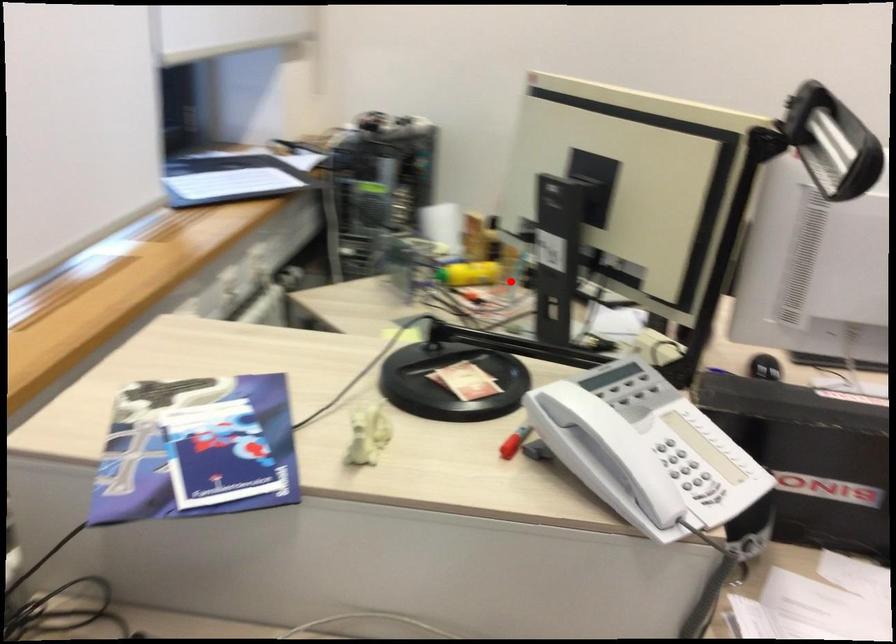
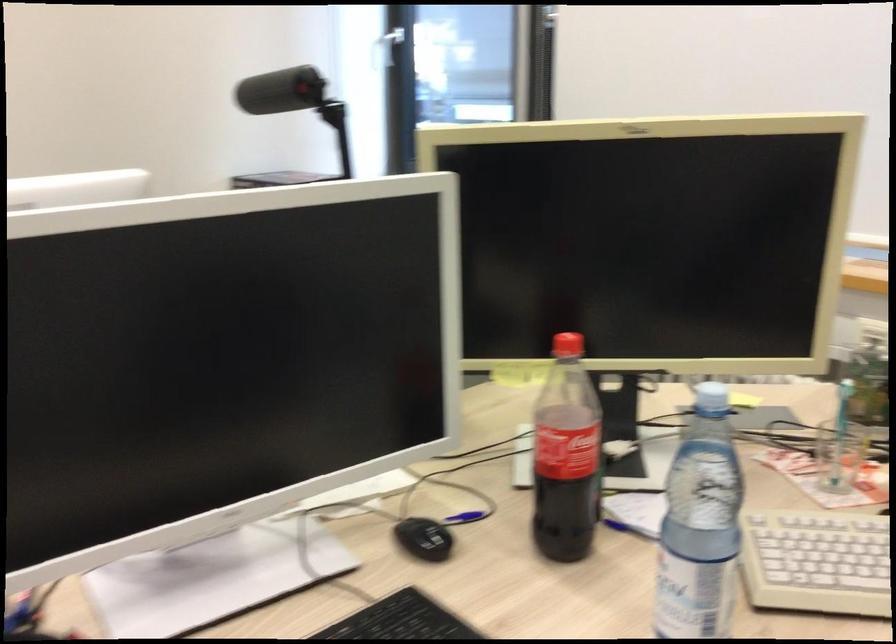
In the second image, find the point that corresponds to the highlighted location in the first image.

(839, 456)